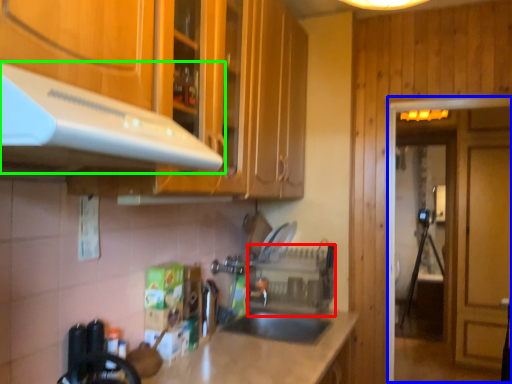
Question: Which object is the closest to the appliance (highlighted by a red box)? Choose among these: glass door (highlighted by a blue box) or exhaust hood (highlighted by a green box).

Choices:
 (A) glass door
 (B) exhaust hood

Answer: (A)